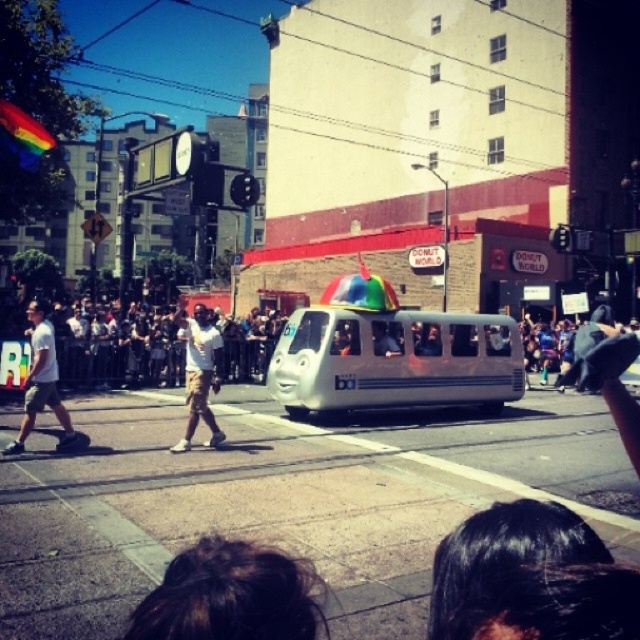
The image size is (640, 640). What do you see at coordinates (394, 360) in the screenshot? I see `white matte bus at center` at bounding box center [394, 360].

Who is positioned more to the right, white matte bus at center or white cotton shirt at left?

white matte bus at center

Between point (317, 346) and point (33, 308), which one is positioned behind?

The point (317, 346) is more distant.

The height and width of the screenshot is (640, 640). I want to click on white matte bus at center, so click(394, 360).

What do you see at coordinates (232, 595) in the screenshot? The width and height of the screenshot is (640, 640). I see `dark brown hair at lower center` at bounding box center [232, 595].

This screenshot has width=640, height=640. What are the coordinates of `dark brown hair at lower center` in the screenshot? It's located at (232, 595).

Can you confirm if dark brown hair at lower center is smaller than white cotton shirt at left?

Yes.

Can you confirm if dark brown hair at lower center is bigger than white cotton shirt at left?

Actually, dark brown hair at lower center might be smaller than white cotton shirt at left.

Who is more distant from viewer, (x=284, y=598) or (x=49, y=381)?

Point (x=49, y=381)

Find the location of a particular element. dark brown hair at lower center is located at coordinates (232, 595).